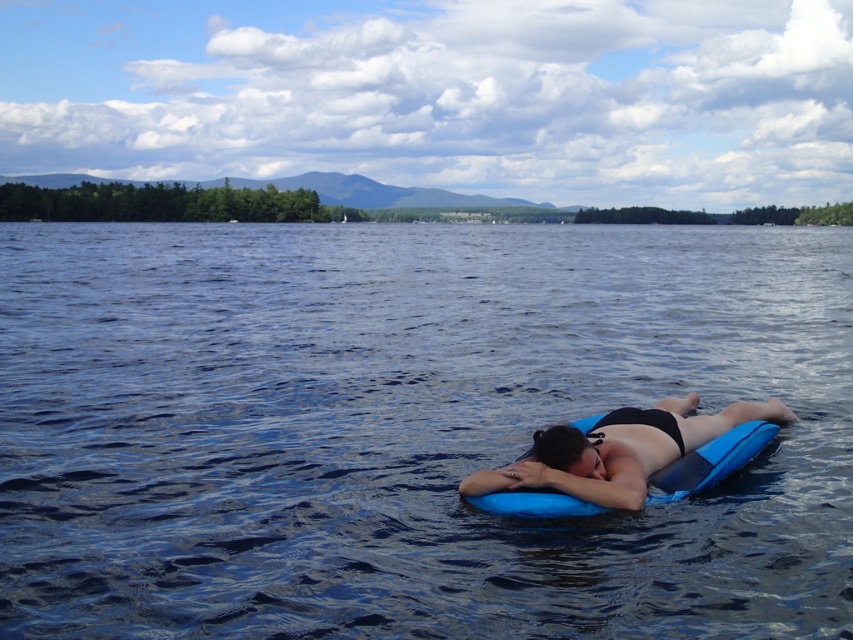
You are a photographer trying to capture a clear shot of the blue rubber mat at center and the matte blue foam at center. Which object should you focus on first if you want to start with the one closer to the left side?

The blue rubber mat at center is positioned on the left side of matte blue foam at center, so you should focus on the blue rubber mat at center first since it is closer to the left side.

Looking at this image, you are a lifeguard on duty and need to reach both the blue rubber mat at center and the matte blue foam at center in the water. Which one is farther away from you if you are standing at the lakeside shore?

The distance between the blue rubber mat at center and the matte blue foam at center is 48.82 feet. Since you are at the lakeside shore, the one farther away would depend on their positions relative to the shore. However, the question states the distance between them, not from the shore. Without additional information about their individual distances from the shore, it is impossible to determine which is farther away.

You are a photographer trying to capture the perfect shot of the two points in the scene. Which point, point [202,592] or point [595,467], will appear larger in your photo?

Point [202,592] will appear larger in the photo because it is closer to the camera than point [595,467].